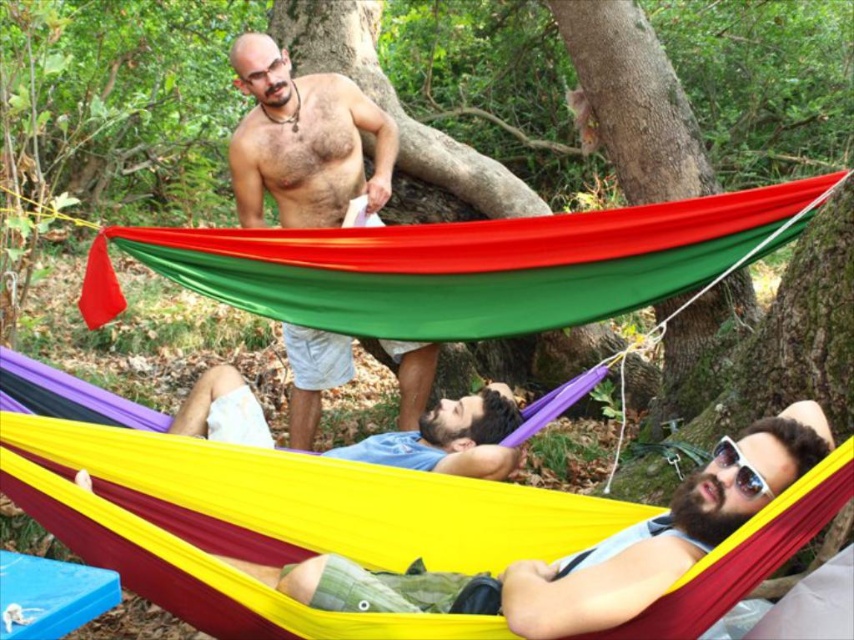
You are an artist trying to sketch the scene. You want to place the shiny silver necklace at upper center accurately. What are the coordinates for its position?

The shiny silver necklace at upper center is located at coordinates (x=303, y=141).